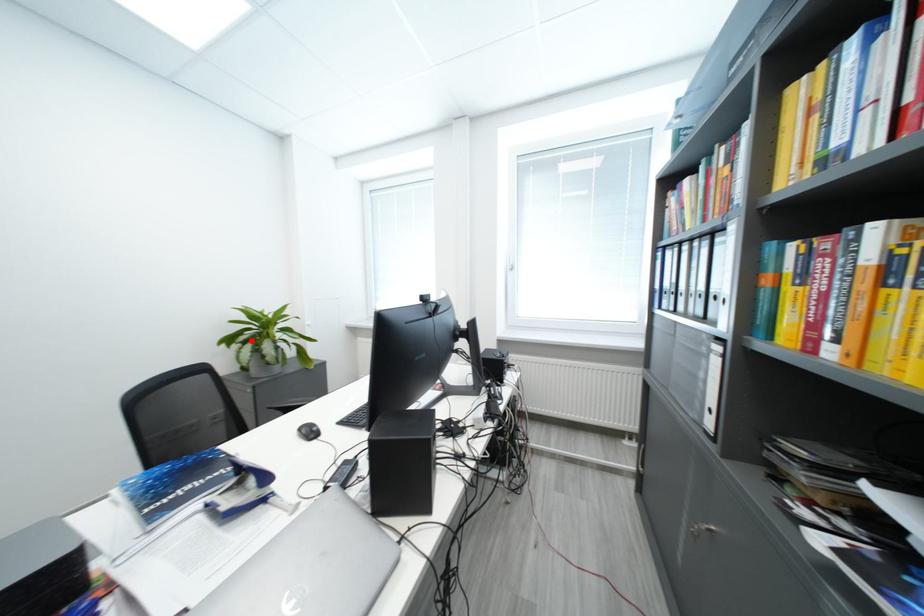
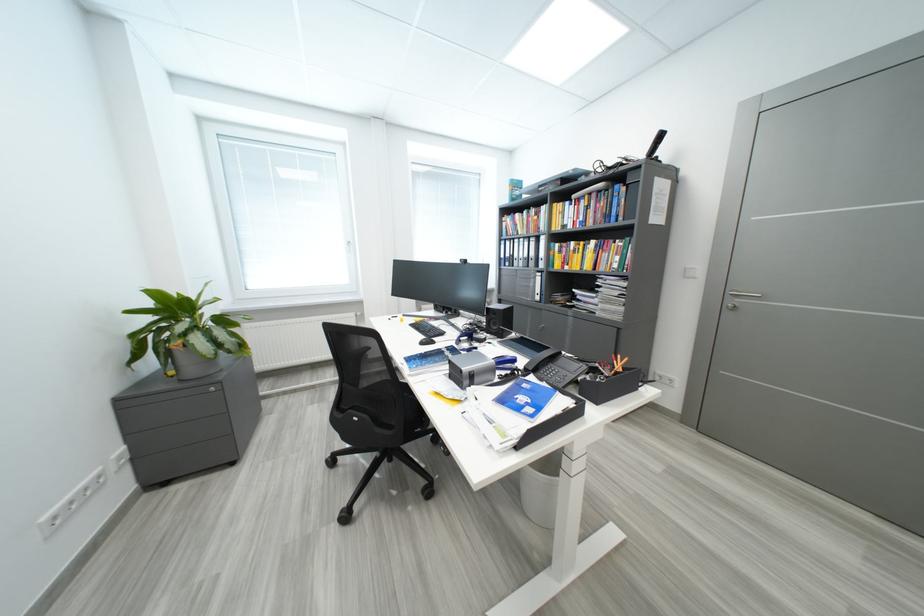
Locate, in the second image, the point that corresponds to the highlighted location in the first image.

(189, 331)